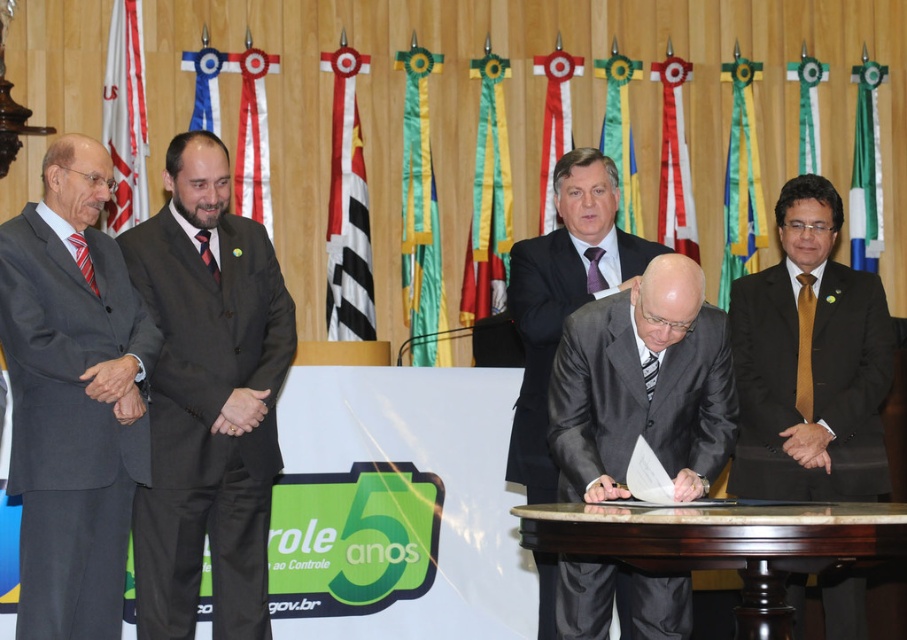
Between matte black suit at right and white and black striped flag at center, which one has less height?

Standing shorter between the two is matte black suit at right.

Which is behind, point (742, 292) or point (340, 125)?

Positioned behind is point (340, 125).

Is point (752, 481) farther from camera compared to point (350, 132)?

No, (752, 481) is in front of (350, 132).

You are a GUI agent. You are given a task and a screenshot of the screen. Output one action in this format:
    pyautogui.click(x=<x>, y=<y>)
    Task: Click on the matte black suit at right
    This screenshot has height=640, width=907.
    Given the screenshot: What is the action you would take?
    pyautogui.click(x=811, y=364)

Does dark gray suit at center have a larger size compared to red fabric flag at left?

Yes.

Is dark gray suit at center thinner than red fabric flag at left?

In fact, dark gray suit at center might be wider than red fabric flag at left.

Is point (162, 449) less distant than point (249, 145)?

Yes, point (162, 449) is in front of point (249, 145).

Locate an element on the screen. The width and height of the screenshot is (907, 640). dark gray suit at center is located at coordinates (207, 401).

Can you confirm if green fabric ribbon at upper center is bigger than blue fabric ribbon at upper left?

Indeed, green fabric ribbon at upper center has a larger size compared to blue fabric ribbon at upper left.

Does green fabric ribbon at upper center lie in front of blue fabric ribbon at upper left?

That is False.

Identify the location of green fabric ribbon at upper center. (807, 108).